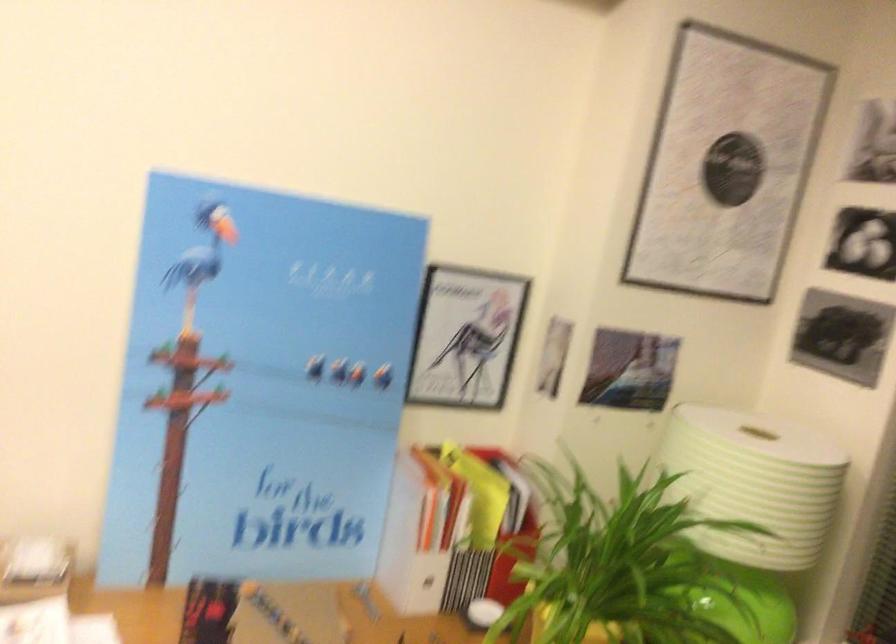
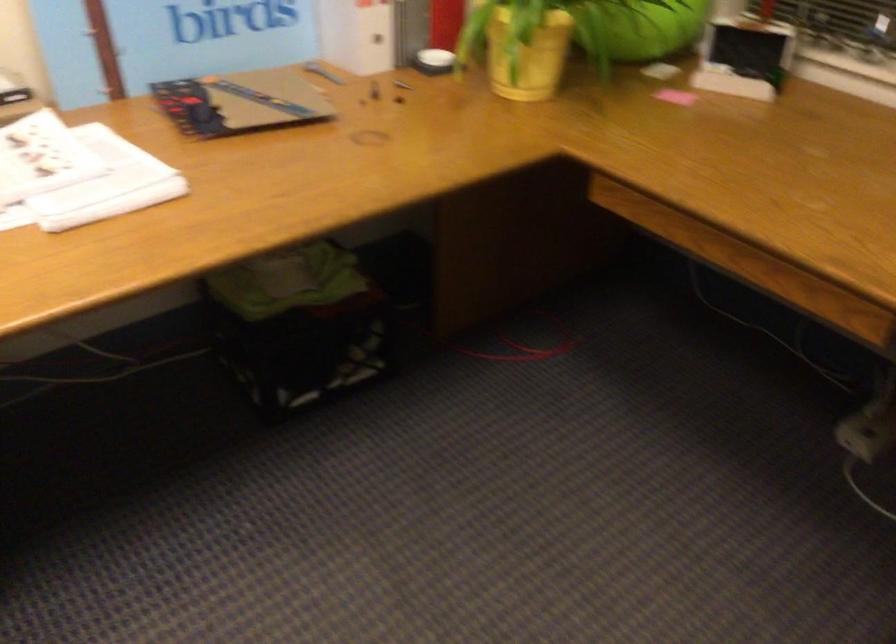
Question: How did the camera likely rotate?

Choices:
 (A) Left
 (B) Right
 (C) Up
 (D) Down

Answer: (D)